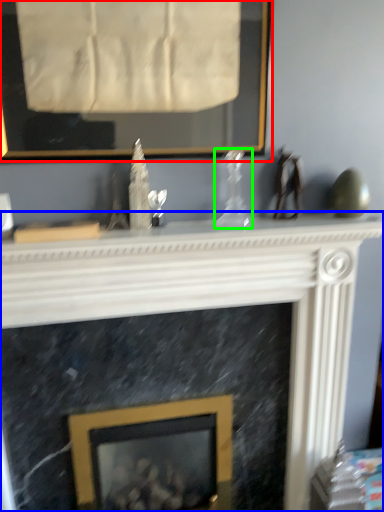
Question: Considering the real-world distances, which object is closest to picture frame (highlighted by a red box)? fireplace (highlighted by a blue box) or glass vase (highlighted by a green box).

Choices:
 (A) fireplace
 (B) glass vase

Answer: (B)